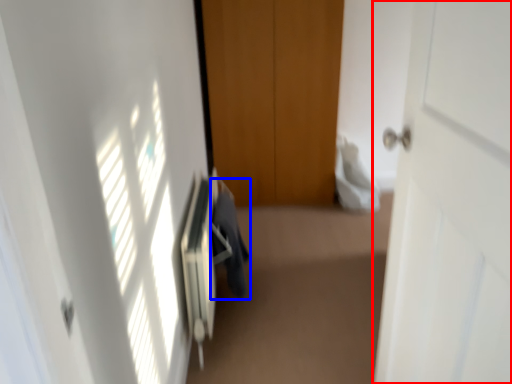
Question: Which object appears closest to the camera in this image, door (highlighted by a red box) or laundry (highlighted by a blue box)?

Choices:
 (A) door
 (B) laundry

Answer: (A)